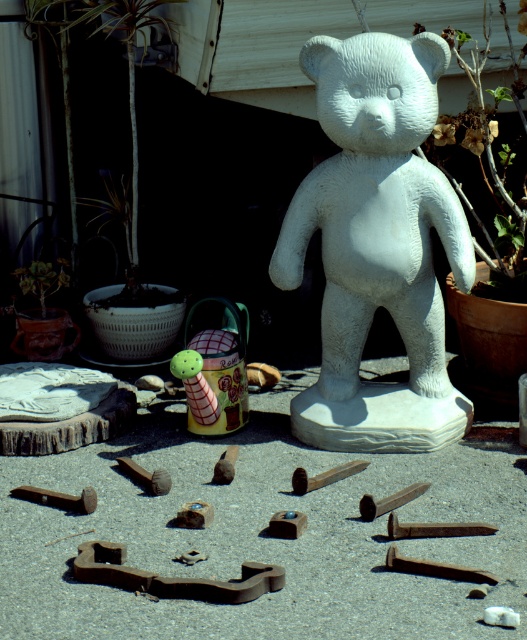
Is white stone bear at center thinner than green rubber toy at center?

No, white stone bear at center is not thinner than green rubber toy at center.

Does point (370, 410) come closer to viewer compared to point (193, 387)?

No.

Identify the location of white stone bear at center. This screenshot has height=640, width=527. (376, 244).